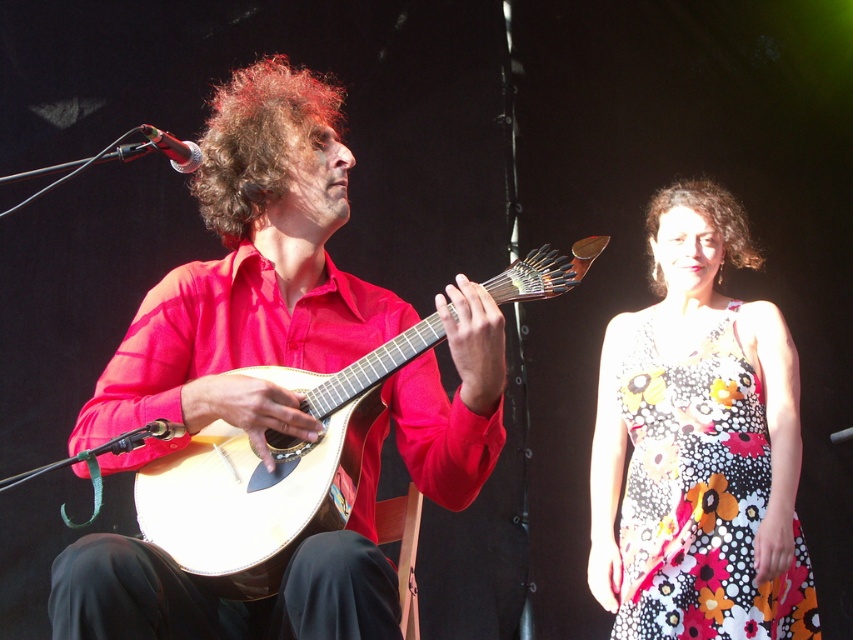
Is matte red shirt at center positioned behind light wood acoustic guitar at center?

No, it is not.

Does point (155, 371) lie behind point (257, 528)?

Yes, point (155, 371) is behind point (257, 528).

You are a GUI agent. You are given a task and a screenshot of the screen. Output one action in this format:
    pyautogui.click(x=<x>, y=<y>)
    Task: Click on the matte red shirt at center
    The image size is (853, 640).
    Given the screenshot: What is the action you would take?
    pyautogui.click(x=251, y=273)

Which is below, curly brown hair at center or curly brown hair at upper right?

curly brown hair at upper right is lower down.

Does curly brown hair at center appear on the right side of curly brown hair at upper right?

No, curly brown hair at center is not to the right of curly brown hair at upper right.

The width and height of the screenshot is (853, 640). In order to click on curly brown hair at center in this screenshot , I will do `click(258, 141)`.

Is matte red shirt at center bigger than curly brown hair at center?

Yes.

Which is more to the left, matte red shirt at center or curly brown hair at center?

curly brown hair at center is more to the left.

Is point (251, 340) positioned after point (274, 100)?

No, (251, 340) is closer to viewer.

Where is `matte red shirt at center`? matte red shirt at center is located at coordinates (251, 273).